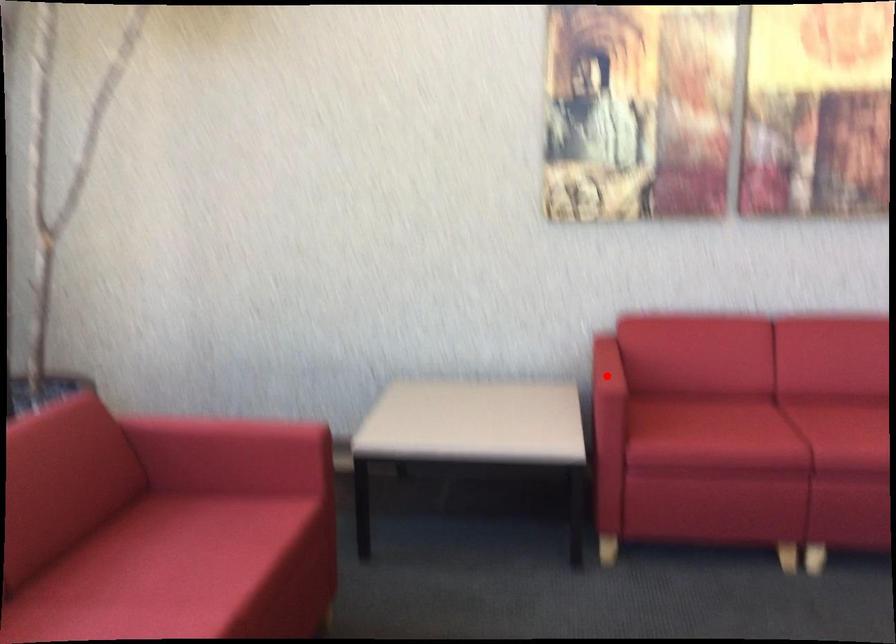
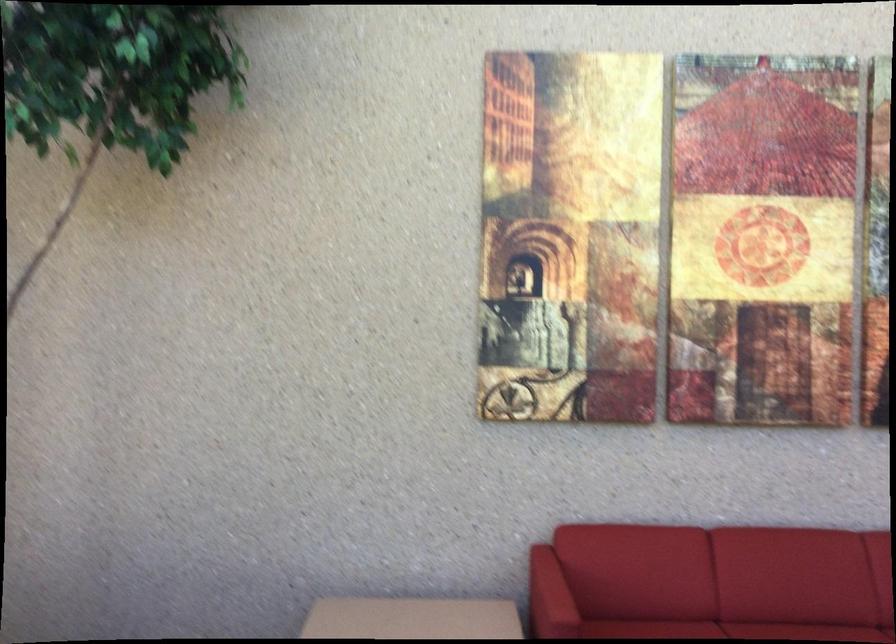
In the second image, find the point that corresponds to the highlighted location in the first image.

(549, 597)